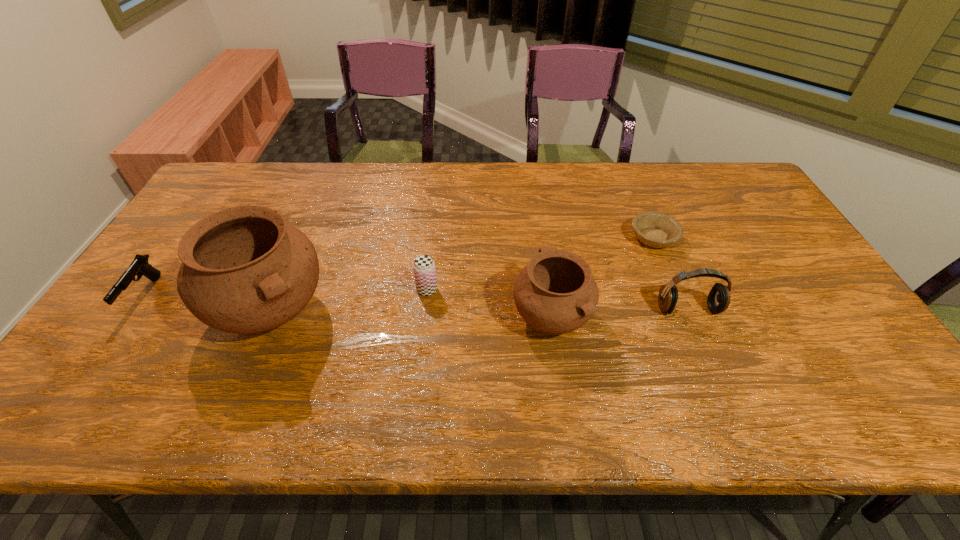
Identify the location of free space located 0.190m on the back of the second object from left to right. Image resolution: width=960 pixels, height=540 pixels. (309, 222).

Find the location of a particular element. This screenshot has width=960, height=540. vacant space located on the back of the shorter pottery is located at coordinates (536, 207).

The width and height of the screenshot is (960, 540). What are the coordinates of `free space located 0.240m on the right of the bowl` in the screenshot? It's located at (757, 239).

The image size is (960, 540). In order to click on vacant space located on the right of the fourth object from right to left in this screenshot , I will do `click(564, 289)`.

The image size is (960, 540). I want to click on free spot located at the aiming end of the leftmost object, so click(x=107, y=348).

At what (x,y) coordinates should I click in order to perform the action: click on vacant space located 0.170m on the ear cups of the headset. Please return your answer as a coordinate pair (x, y). The width and height of the screenshot is (960, 540). Looking at the image, I should click on (717, 379).

This screenshot has height=540, width=960. Find the location of `object positioned at the left edge`. object positioned at the left edge is located at coordinates (139, 266).

Image resolution: width=960 pixels, height=540 pixels. I want to click on free spot at the far edge of the desktop, so click(x=448, y=193).

Find the location of a particular element. The width and height of the screenshot is (960, 540). vacant space at the near edge of the desktop is located at coordinates (294, 373).

Locate an element on the screen. The width and height of the screenshot is (960, 540). free location at the near right corner of the desktop is located at coordinates (871, 355).